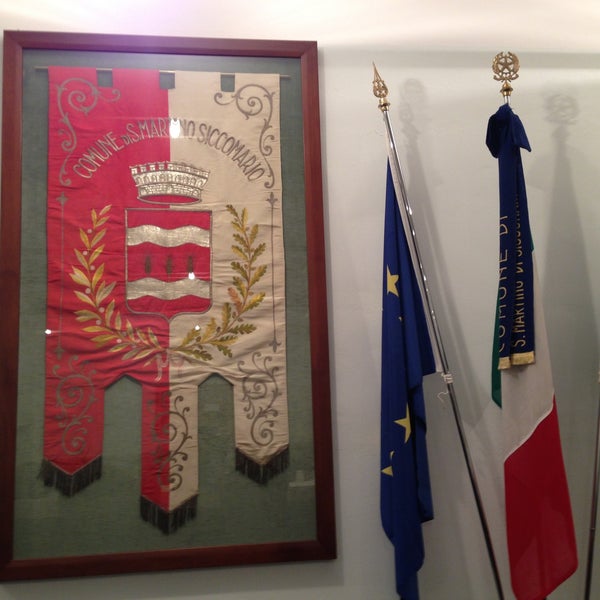
You are a GUI agent. You are given a task and a screenshot of the screen. Output one action in this format:
    pyautogui.click(x=<x>, y=<y>)
    Task: Click on the wooden frame
    The image size is (600, 600).
    Given the screenshot: What is the action you would take?
    pyautogui.click(x=320, y=322), pyautogui.click(x=5, y=285), pyautogui.click(x=168, y=556), pyautogui.click(x=155, y=42)